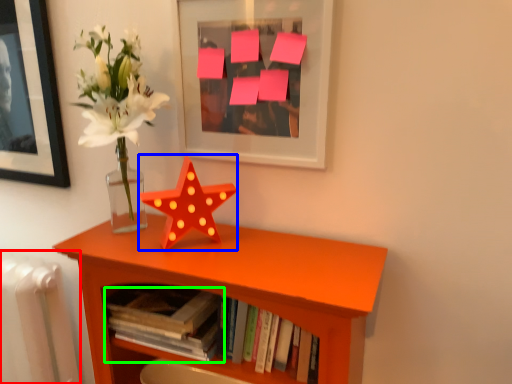
Question: Estimate the real-world distances between objects in this image. Which object is farther from radiator (highlighted by a red box), flower (highlighted by a blue box) or book (highlighted by a green box)?

Choices:
 (A) flower
 (B) book

Answer: (A)